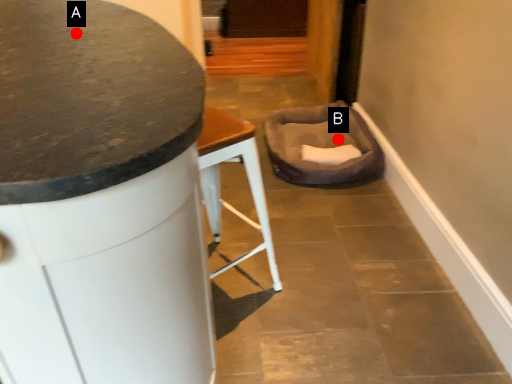
Question: Two points are circled on the image, labeled by A and B beside each circle. Among these points, which one is nearest to the camera?

Choices:
 (A) A is closer
 (B) B is closer

Answer: (A)